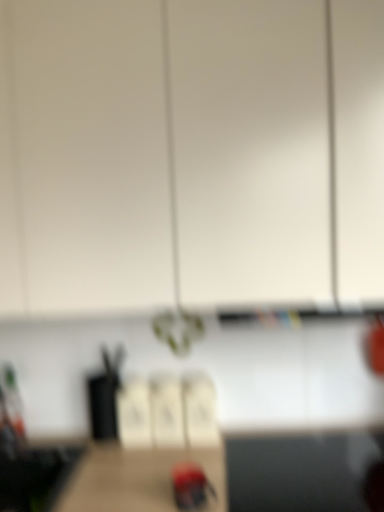
Question: From the image's perspective, is white matte cabinet at upper center located above smooth red woodpecker at center?

Choices:
 (A) yes
 (B) no

Answer: (A)

Question: Does white matte cabinet at upper center turn towards smooth red woodpecker at center?

Choices:
 (A) yes
 (B) no

Answer: (B)

Question: Does white matte cabinet at upper center have a greater height compared to smooth red woodpecker at center?

Choices:
 (A) no
 (B) yes

Answer: (B)

Question: From the image's perspective, is white matte cabinet at upper center under smooth red woodpecker at center?

Choices:
 (A) no
 (B) yes

Answer: (A)

Question: Does white matte cabinet at upper center have a greater width compared to smooth red woodpecker at center?

Choices:
 (A) yes
 (B) no

Answer: (A)

Question: Would you say smooth red woodpecker at center is part of white matte cabinet at upper center's contents?

Choices:
 (A) yes
 (B) no

Answer: (B)

Question: Is smooth red woodpecker at center positioned in front of white matte cabinet at upper center?

Choices:
 (A) no
 (B) yes

Answer: (A)

Question: Is smooth red woodpecker at center turned away from white matte cabinet at upper center?

Choices:
 (A) no
 (B) yes

Answer: (A)

Question: Is smooth red woodpecker at center aimed at white matte cabinet at upper center?

Choices:
 (A) yes
 (B) no

Answer: (B)

Question: Can you confirm if smooth red woodpecker at center is positioned to the left of white matte cabinet at upper center?

Choices:
 (A) yes
 (B) no

Answer: (B)

Question: Is smooth red woodpecker at center further to camera compared to white matte cabinet at upper center?

Choices:
 (A) no
 (B) yes

Answer: (B)

Question: Does smooth red woodpecker at center have a larger size compared to white matte cabinet at upper center?

Choices:
 (A) yes
 (B) no

Answer: (B)

Question: Is white matte cabinet at upper center bigger or smaller than smooth red woodpecker at center?

Choices:
 (A) big
 (B) small

Answer: (A)